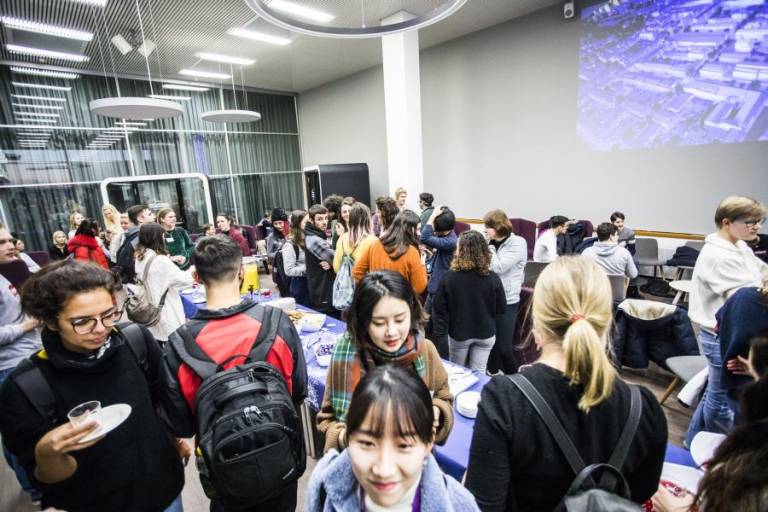
Identify the location of chairs. pyautogui.click(x=643, y=257), pyautogui.click(x=694, y=250), pyautogui.click(x=687, y=369).